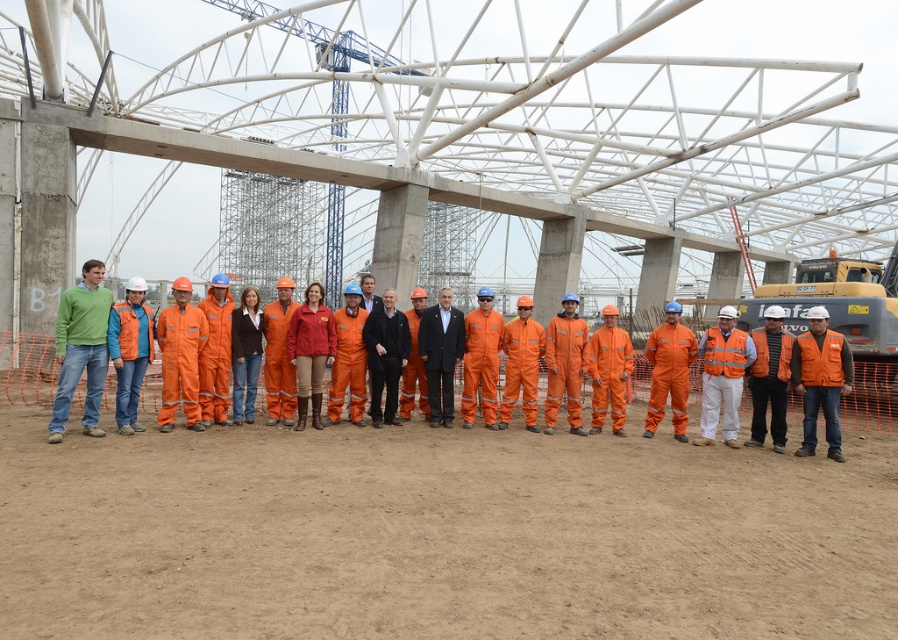
Question: Can you confirm if orange uniform at center is thinner than orange reflective vest at center?

Choices:
 (A) no
 (B) yes

Answer: (A)

Question: Is orange uniform at center wider than orange reflective vest at center?

Choices:
 (A) yes
 (B) no

Answer: (A)

Question: Which point is closer to the camera?

Choices:
 (A) orange uniform at center
 (B) orange reflective vest at center

Answer: (A)

Question: Which point is closer to the camera?

Choices:
 (A) (832, 368)
 (B) (185, 294)

Answer: (A)

Question: Which object is closer to the camera taking this photo?

Choices:
 (A) orange reflective vest at center
 (B) orange uniform at center

Answer: (B)

Question: Is orange uniform at center below orange reflective vest at center?

Choices:
 (A) yes
 (B) no

Answer: (B)